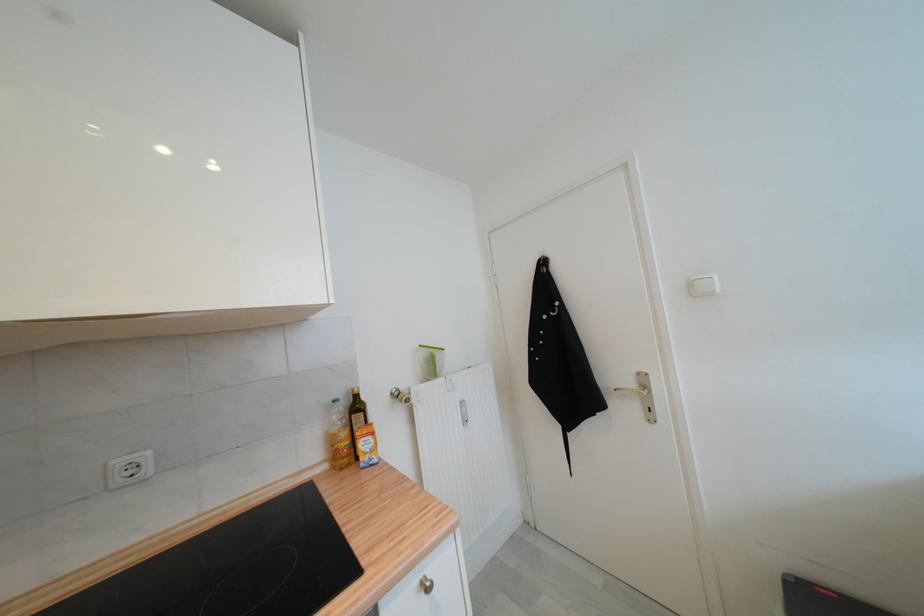
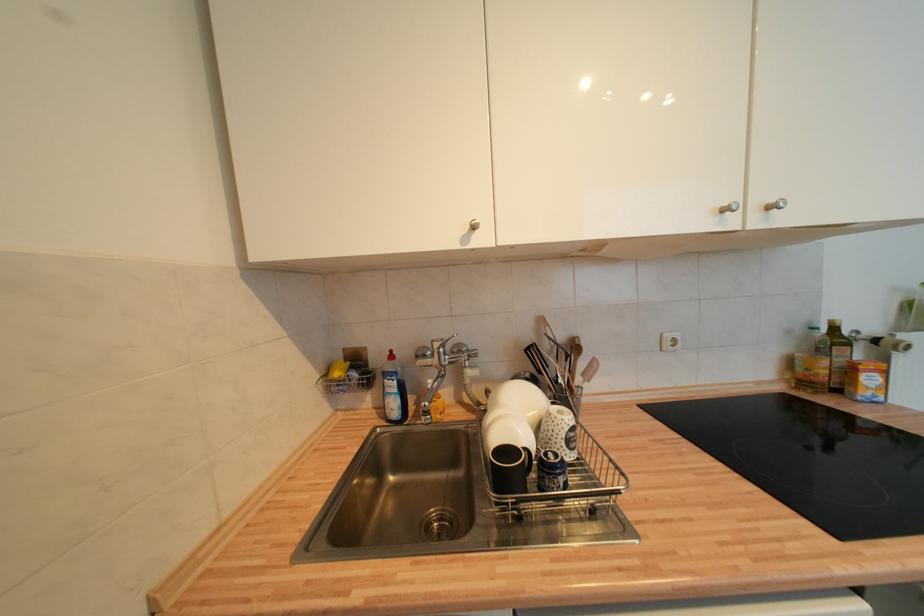
Where in the second image is the point corresponding to pixel 339 403 from the first image?

(819, 331)